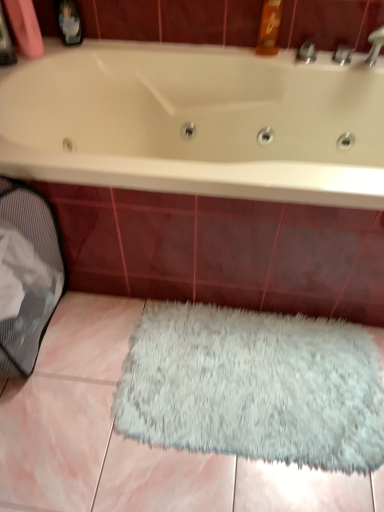
Question: Is white fluffy rug at lower center facing away from white glossy bathtub at upper center?

Choices:
 (A) no
 (B) yes

Answer: (A)

Question: Considering the relative positions of white fluffy rug at lower center and white glossy bathtub at upper center in the image provided, is white fluffy rug at lower center behind white glossy bathtub at upper center?

Choices:
 (A) yes
 (B) no

Answer: (A)

Question: Can you confirm if white fluffy rug at lower center is thinner than white glossy bathtub at upper center?

Choices:
 (A) no
 (B) yes

Answer: (A)

Question: Are white fluffy rug at lower center and white glossy bathtub at upper center located far from each other?

Choices:
 (A) no
 (B) yes

Answer: (A)

Question: From a real-world perspective, is white fluffy rug at lower center located higher than white glossy bathtub at upper center?

Choices:
 (A) yes
 (B) no

Answer: (B)

Question: Is white fluffy rug at lower center to the right of white glossy bathtub at upper center from the viewer's perspective?

Choices:
 (A) yes
 (B) no

Answer: (A)

Question: From a real-world perspective, is white glossy bathtub at upper center over white fluffy rug at lower center?

Choices:
 (A) yes
 (B) no

Answer: (A)

Question: Is white glossy bathtub at upper center positioned behind white fluffy rug at lower center?

Choices:
 (A) no
 (B) yes

Answer: (A)

Question: From the image's perspective, is white glossy bathtub at upper center under white fluffy rug at lower center?

Choices:
 (A) no
 (B) yes

Answer: (A)

Question: Does white glossy bathtub at upper center have a larger size compared to white fluffy rug at lower center?

Choices:
 (A) yes
 (B) no

Answer: (A)

Question: Does white glossy bathtub at upper center have a greater height compared to white fluffy rug at lower center?

Choices:
 (A) no
 (B) yes

Answer: (B)

Question: Considering the relative sizes of white glossy bathtub at upper center and white fluffy rug at lower center in the image provided, is white glossy bathtub at upper center shorter than white fluffy rug at lower center?

Choices:
 (A) no
 (B) yes

Answer: (A)

Question: Is white glossy bathtub at upper center completely or partially outside of gray mesh laundry basket at lower left?

Choices:
 (A) yes
 (B) no

Answer: (A)